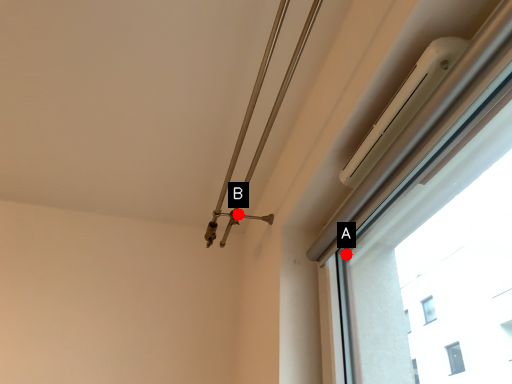
Question: Two points are circled on the image, labeled by A and B beside each circle. Which of the following is the closest to the observer?

Choices:
 (A) A is closer
 (B) B is closer

Answer: (A)